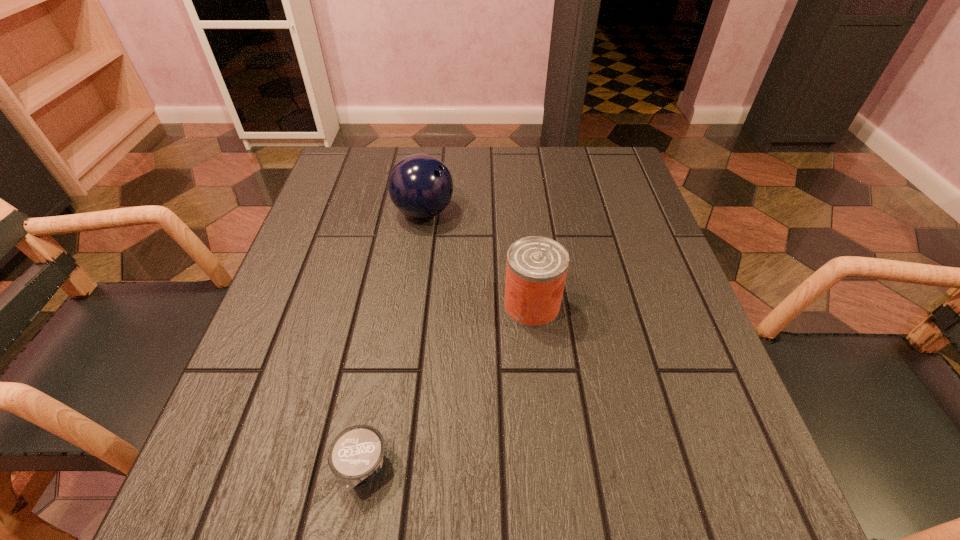
Identify the location of the farthest object. The height and width of the screenshot is (540, 960). (420, 186).

Identify the location of the second farthest object. This screenshot has height=540, width=960. (536, 269).

The image size is (960, 540). In order to click on can in this screenshot , I will do `click(536, 269)`.

You are a GUI agent. You are given a task and a screenshot of the screen. Output one action in this format:
    pyautogui.click(x=<x>, y=<y>)
    Task: Click on the shortest object
    The height and width of the screenshot is (540, 960).
    Given the screenshot: What is the action you would take?
    pyautogui.click(x=355, y=456)

Where is `the nearest object`? Image resolution: width=960 pixels, height=540 pixels. the nearest object is located at coordinates (355, 456).

Identify the location of vacant position located 0.170m on the surface of the bowling ball near the finger holes. (527, 212).

Where is `free space located on the back of the can`? free space located on the back of the can is located at coordinates 523,225.

Locate an element on the screen. The image size is (960, 540). vacant space located 0.310m on the right of the shortest object is located at coordinates (607, 469).

I want to click on object that is at the far edge, so click(420, 186).

Where is `object that is at the near edge`? The height and width of the screenshot is (540, 960). object that is at the near edge is located at coordinates (355, 456).